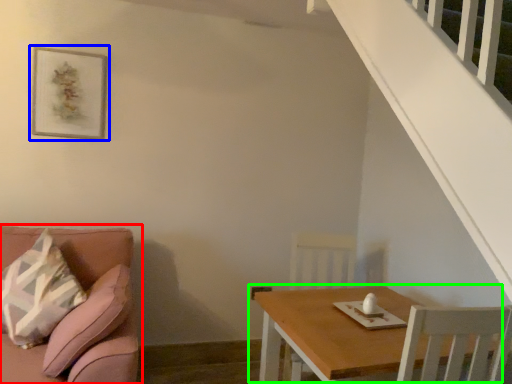
Question: Which is nearer to the studio couch (highlighted by a red box)? picture frame (highlighted by a blue box) or table (highlighted by a green box).

Choices:
 (A) picture frame
 (B) table

Answer: (B)